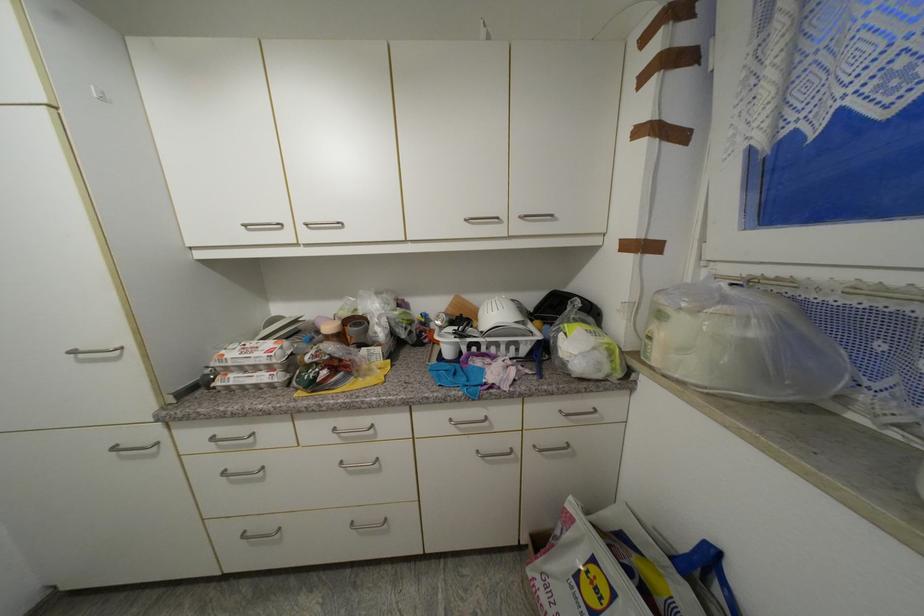
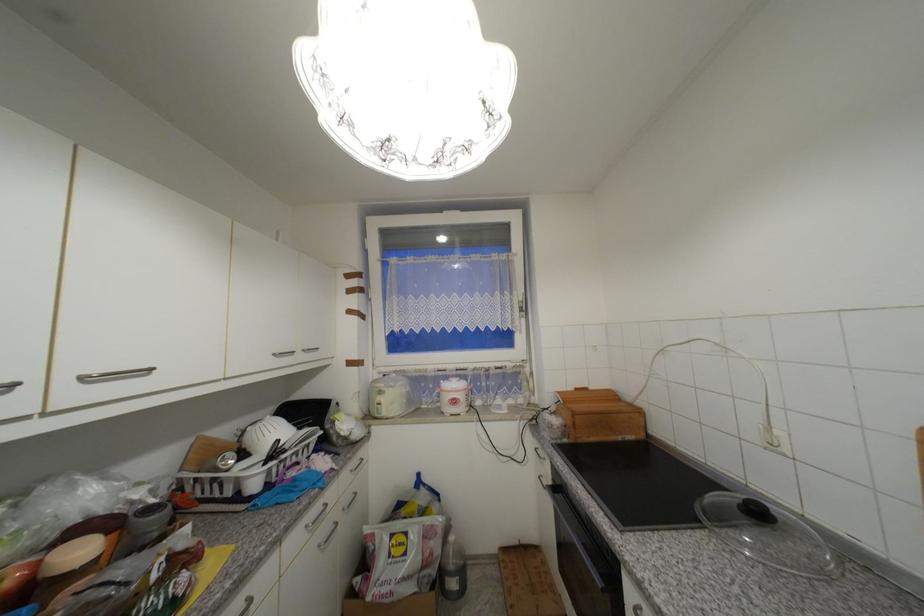
In the second image, find the point that corresponds to the point at 286,225 in the first image.

(19, 386)